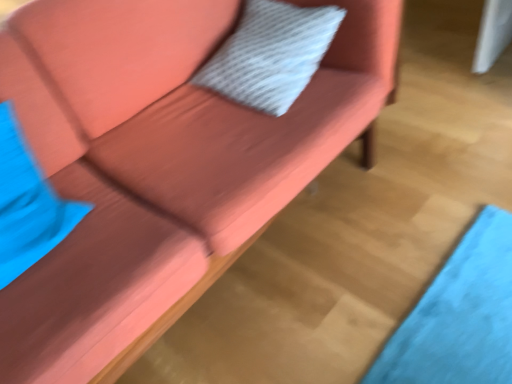
Question: In terms of height, does white textured pillow at center, which appears as the second pillow when viewed from the front, look taller or shorter compared to blue fabric pillow at left, which ranks as the first pillow in bottom-to-top order?

Choices:
 (A) short
 (B) tall

Answer: (A)

Question: From a real-world perspective, is white textured pillow at center, which appears as the second pillow when viewed from the front, physically located above or below blue fabric pillow at left, which is the 1th pillow from front to back?

Choices:
 (A) below
 (B) above

Answer: (A)

Question: Based on their sizes in the image, would you say white textured pillow at center, placed as the 1th pillow when sorted from back to front, is bigger or smaller than blue fabric pillow at left, which ranks as the first pillow in bottom-to-top order?

Choices:
 (A) big
 (B) small

Answer: (A)

Question: Considering their positions, is blue fabric pillow at left, which ranks as the first pillow in left-to-right order, located in front of or behind white textured pillow at center, placed as the 1th pillow when sorted from back to front?

Choices:
 (A) behind
 (B) front

Answer: (B)

Question: Considering the positions of blue fabric pillow at left, which ranks as the first pillow in left-to-right order, and white textured pillow at center, placed as the 1th pillow when sorted from back to front, in the image, is blue fabric pillow at left, which ranks as the first pillow in left-to-right order, wider or thinner than white textured pillow at center, placed as the 1th pillow when sorted from back to front,?

Choices:
 (A) thin
 (B) wide

Answer: (A)

Question: Considering the positions of point click(67, 226) and point click(224, 74), is point click(67, 226) closer or farther from the camera than point click(224, 74)?

Choices:
 (A) farther
 (B) closer

Answer: (B)

Question: From a real-world perspective, relative to white textured pillow at center, placed as the 1th pillow when sorted from back to front, is blue fabric pillow at left, the 2th pillow from the back, vertically above or below?

Choices:
 (A) above
 (B) below

Answer: (A)